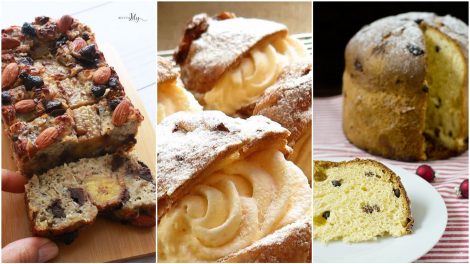
Locate an element on the screen. black wall is located at coordinates point(343,34).